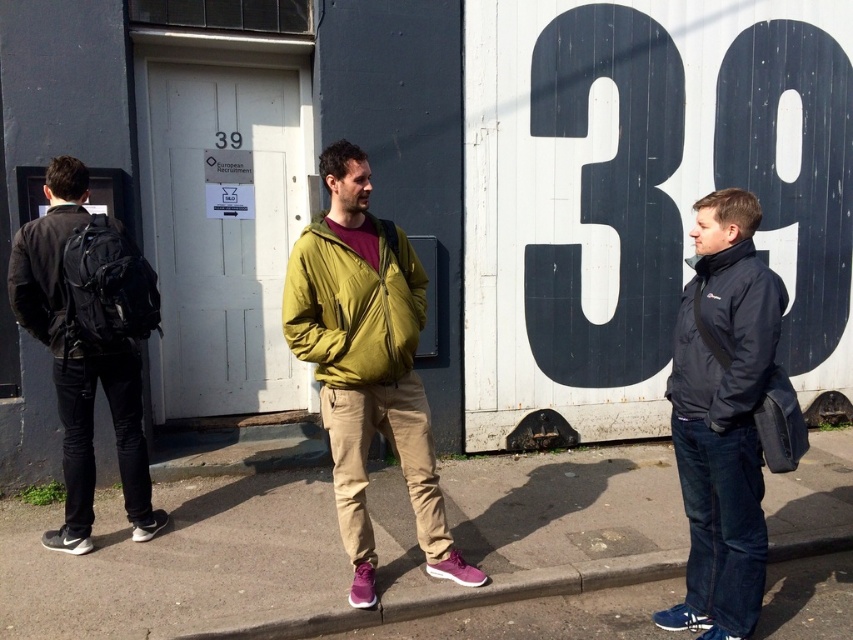
Can you confirm if dark blue jacket at right is smaller than concrete at lower center?

Actually, dark blue jacket at right might be larger than concrete at lower center.

Image resolution: width=853 pixels, height=640 pixels. What do you see at coordinates (722, 417) in the screenshot?
I see `dark blue jacket at right` at bounding box center [722, 417].

Locate an element on the screen. This screenshot has height=640, width=853. dark blue jacket at right is located at coordinates (722, 417).

I want to click on dark blue jacket at right, so click(722, 417).

Does matte olive green jacket at center have a larger size compared to black matte jacket at right?

Yes.

Is matte olive green jacket at center positioned at the back of black matte jacket at right?

Yes, it is.

Who is more forward, (412,284) or (763,273)?

Point (763,273) is more forward.

Where is `matte olive green jacket at center`? The image size is (853, 640). matte olive green jacket at center is located at coordinates (352, 307).

Does dark blue jacket at right have a lesser width compared to black matte backpack at left?

Correct, dark blue jacket at right's width is less than black matte backpack at left's.

Is dark blue jacket at right positioned behind black matte backpack at left?

No, it is not.

Is point (741, 625) more distant than point (9, 273)?

No, (741, 625) is in front of (9, 273).

Identify the location of dark blue jacket at right. (722, 417).